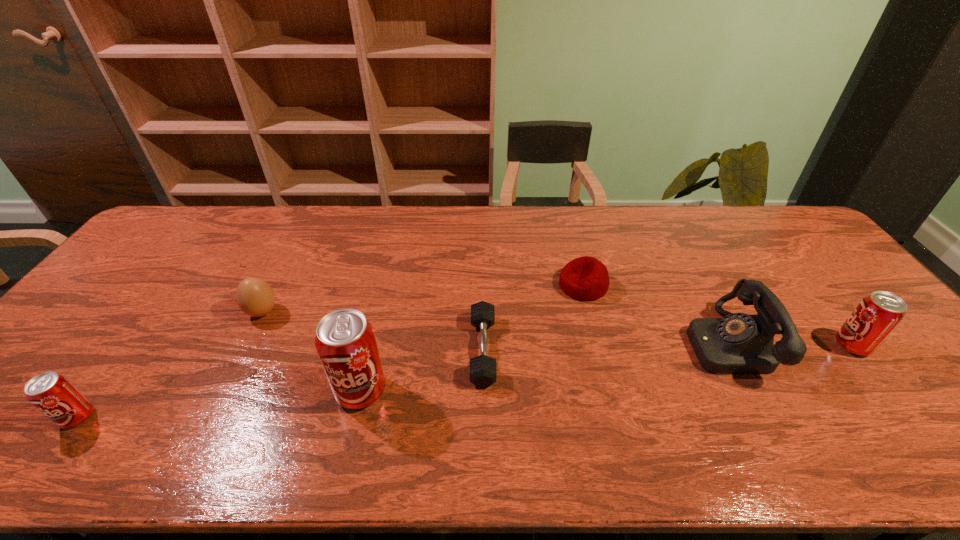
Identify the location of free space for an extra pop_(soda) to achieve even spacing. Image resolution: width=960 pixels, height=540 pixels. (617, 367).